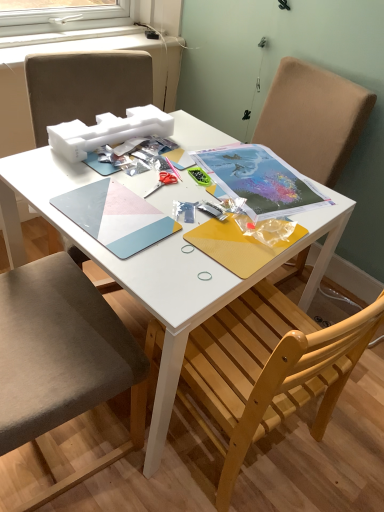
Where is `vacant space in between matte plastic notebook at center, the 2th notebook when ordered from right to left, and metallic silver scissors at center`? vacant space in between matte plastic notebook at center, the 2th notebook when ordered from right to left, and metallic silver scissors at center is located at coordinates (152, 189).